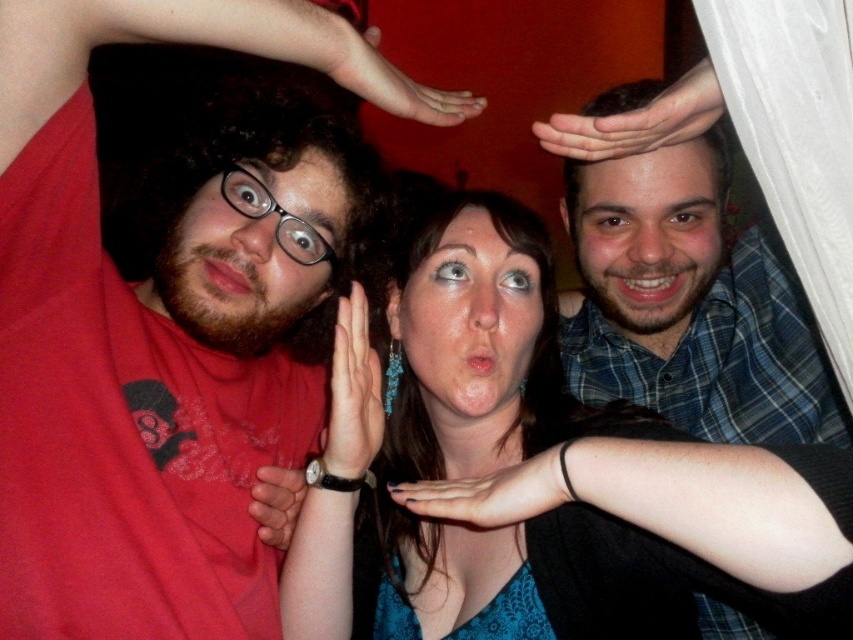
Question: Which of the following is the farthest from the observer?

Choices:
 (A) (503, 204)
 (B) (115, 428)

Answer: (A)

Question: Observing the image, what is the correct spatial positioning of matte blue shirt at right in reference to matte black hand at center?

Choices:
 (A) above
 (B) below

Answer: (A)

Question: Which object is positioned closest to the blue plaid shirt at upper right?

Choices:
 (A) matte skin face at center
 (B) teal lace dress at center

Answer: (A)

Question: Is black matte hand at center bigger than matte black watch at lower left?

Choices:
 (A) no
 (B) yes

Answer: (B)

Question: Which is nearer to the matte skin face at center?

Choices:
 (A) matte black face at left
 (B) matte blue shirt at right

Answer: (A)

Question: Does teal lace dress at center appear on the right side of blue plaid shirt at upper right?

Choices:
 (A) yes
 (B) no

Answer: (B)